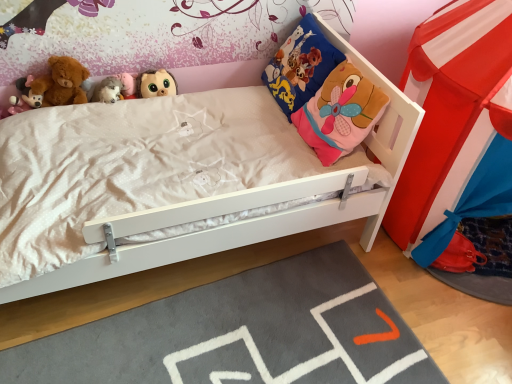
Question: Is matte pink plush toy at upper left, the first toy when ordered from left to right, inside the boundaries of gray soft rug at lower center, or outside?

Choices:
 (A) inside
 (B) outside

Answer: (B)

Question: From the image's perspective, is matte pink plush toy at upper left, the first toy when ordered from left to right, located above or below gray soft rug at lower center?

Choices:
 (A) below
 (B) above

Answer: (B)

Question: Estimate the real-world distances between objects in this image. Which object is closer to the matte brown plush toy at upper center, which is the 1th toy in right-to-left order?

Choices:
 (A) white plush toy at upper left, positioned as the 2th toy in right-to-left order
 (B) soft plush teddy bear at upper left
 (C) blue fabric pillow at upper right
 (D) gray soft rug at lower center
 (E) matte pink plush toy at upper left, marked as the third toy in a right-to-left arrangement

Answer: (A)

Question: Considering the real-world distances, which object is closest to the matte brown plush toy at upper center, placed as the third toy when sorted from left to right?

Choices:
 (A) white plush toy at upper left, marked as the 2th toy in a left-to-right arrangement
 (B) soft plush teddy bear at upper left
 (C) blue fabric pillow at upper right
 (D) matte pink plush toy at upper left, the first toy when ordered from left to right
 (E) gray soft rug at lower center

Answer: (A)